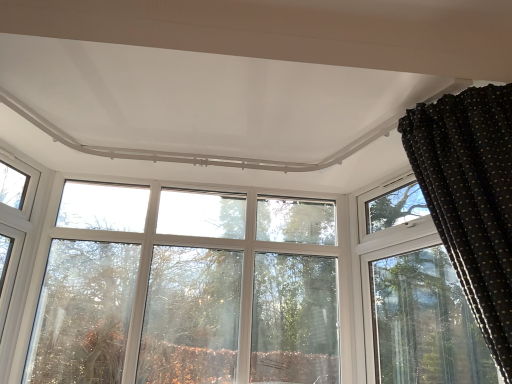
Question: Considering the positions of transparent glass tree at center and black dotted fabric at upper right in the image, is transparent glass tree at center taller or shorter than black dotted fabric at upper right?

Choices:
 (A) tall
 (B) short

Answer: (A)

Question: From a real-world perspective, is transparent glass tree at center positioned above or below black dotted fabric at upper right?

Choices:
 (A) above
 (B) below

Answer: (B)

Question: Which of these objects is positioned closest to the black dotted fabric at upper right?

Choices:
 (A) clear glass window at upper left
 (B) transparent glass tree at center

Answer: (B)

Question: Estimate the real-world distances between objects in this image. Which object is closer to the clear glass window at upper left?

Choices:
 (A) transparent glass tree at center
 (B) black dotted fabric at upper right

Answer: (A)